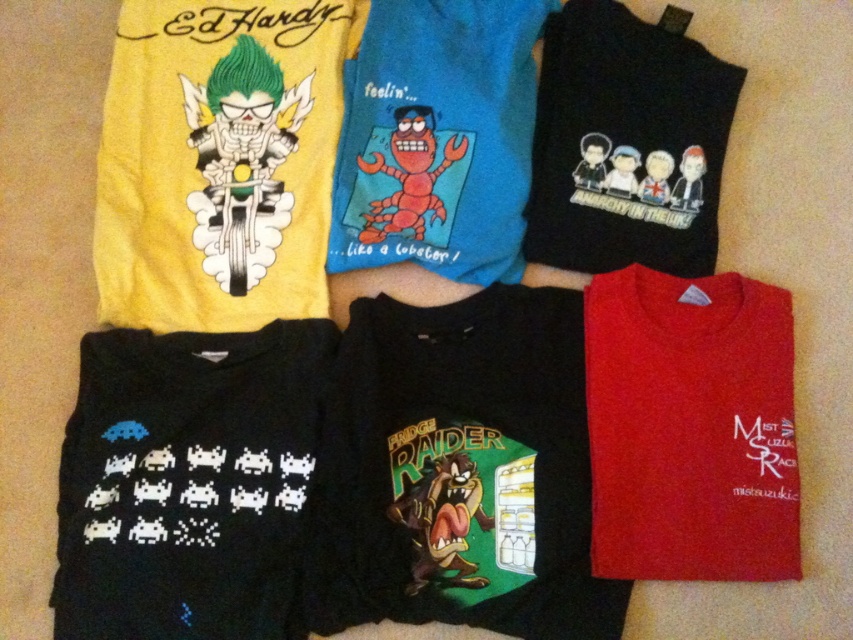
Locate an element on the screen. red cotton t-shirt at lower right is located at coordinates (689, 428).

Locate an element on the screen. The height and width of the screenshot is (640, 853). red cotton t-shirt at lower right is located at coordinates (689, 428).

Does blue matte t-shirt at center have a greater height compared to black matte t-shirt at upper right?

Yes, blue matte t-shirt at center is taller than black matte t-shirt at upper right.

Image resolution: width=853 pixels, height=640 pixels. What are the coordinates of `blue matte t-shirt at center` in the screenshot? It's located at (437, 138).

Locate an element on the screen. blue matte t-shirt at center is located at coordinates (437, 138).

Who is more distant from viewer, (399, 406) or (393, 240)?

Positioned behind is point (393, 240).

Is black matte t-shirt at center further to the viewer compared to blue matte t-shirt at center?

No, black matte t-shirt at center is closer to the viewer.

What do you see at coordinates (459, 472) in the screenshot? This screenshot has height=640, width=853. I see `black matte t-shirt at center` at bounding box center [459, 472].

Where is `black matte t-shirt at center`? The height and width of the screenshot is (640, 853). black matte t-shirt at center is located at coordinates (459, 472).